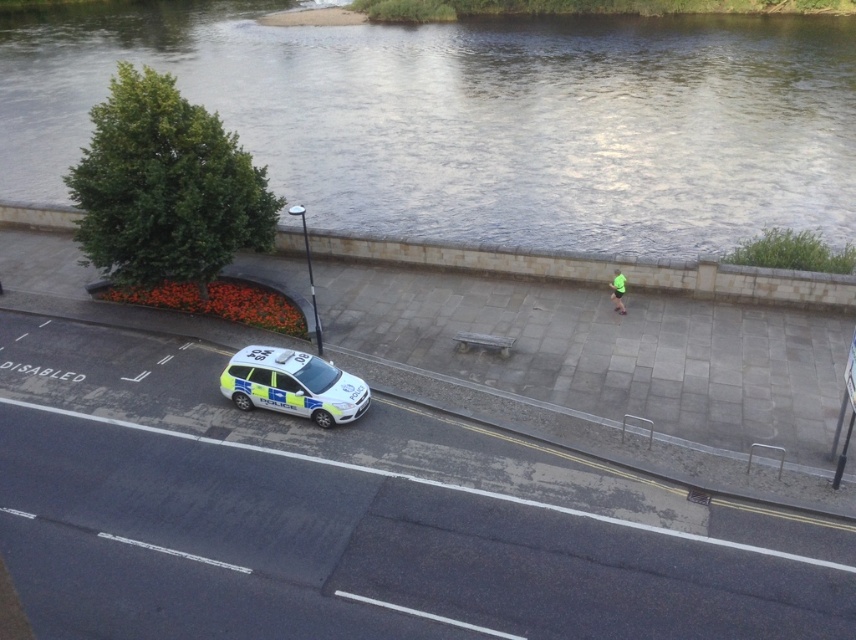
Question: Where is clear water at upper center located in relation to green fabric shorts at center in the image?

Choices:
 (A) above
 (B) below

Answer: (A)

Question: Which object is closer to the camera taking this photo?

Choices:
 (A) clear water at upper center
 (B) white glossy police car at center

Answer: (B)

Question: Is white glossy police car at center to the left of green fabric shorts at center from the viewer's perspective?

Choices:
 (A) no
 (B) yes

Answer: (B)

Question: Which object is closer to the camera taking this photo?

Choices:
 (A) green fabric shorts at center
 (B) clear water at upper center
 (C) white glossy police car at center

Answer: (C)

Question: Which is farther from the white glossy police car at center?

Choices:
 (A) clear water at upper center
 (B) green fabric shorts at center

Answer: (A)

Question: Is clear water at upper center to the left of white glossy police car at center from the viewer's perspective?

Choices:
 (A) no
 (B) yes

Answer: (B)